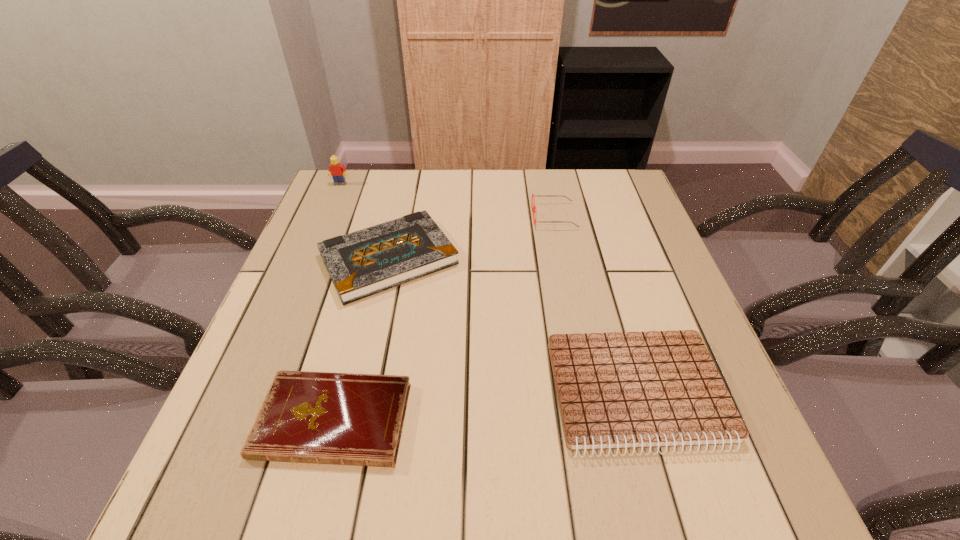
Locate which notebook ranks second in proximity to the tallest notebook. Please provide its 2D coordinates. Your answer should be formatted as a tuple, i.e. [(x, y)], where the tuple contains the x and y coordinates of a point satisfying the conditions above.

[(619, 390)]

The width and height of the screenshot is (960, 540). In order to click on vacant space that satisfies the following two spatial constraints: 1. on the back side of the rightmost notebook; 2. on the front-facing side of the spectacles in this screenshot , I will do `click(586, 216)`.

I want to click on free location that satisfies the following two spatial constraints: 1. on the back side of the farthest notebook; 2. on the right side of the shortest notebook, so click(x=375, y=259).

Find the location of a particular element. The height and width of the screenshot is (540, 960). free space that satisfies the following two spatial constraints: 1. on the front-facing side of the shortest notebook; 2. on the left side of the farthest object is located at coordinates (241, 420).

The height and width of the screenshot is (540, 960). In order to click on vacant area that satisfies the following two spatial constraints: 1. on the front-facing side of the farthest object; 2. on the right side of the tallest notebook in this screenshot , I will do `click(308, 259)`.